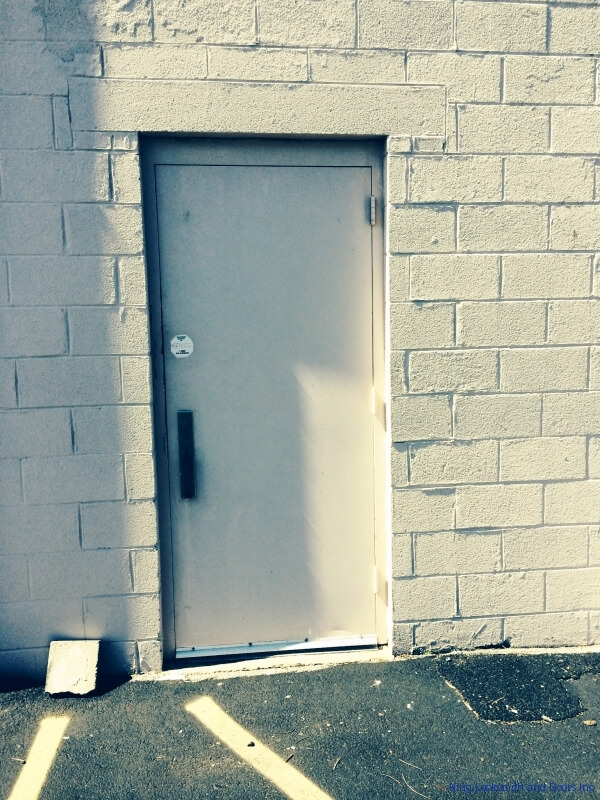
This screenshot has width=600, height=800. I want to click on door jam, so click(x=251, y=158).